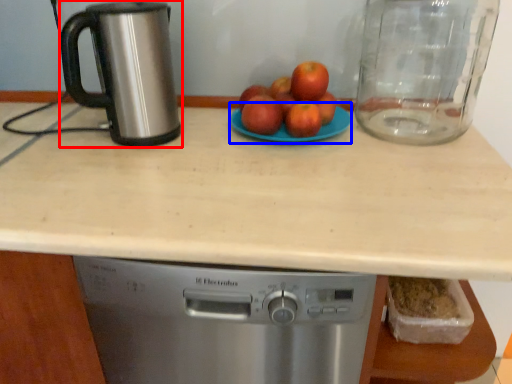
Question: Which of the following is the closest to the observer, kitchen appliance (highlighted by a red box) or glass plate (highlighted by a blue box)?

Choices:
 (A) kitchen appliance
 (B) glass plate

Answer: (A)